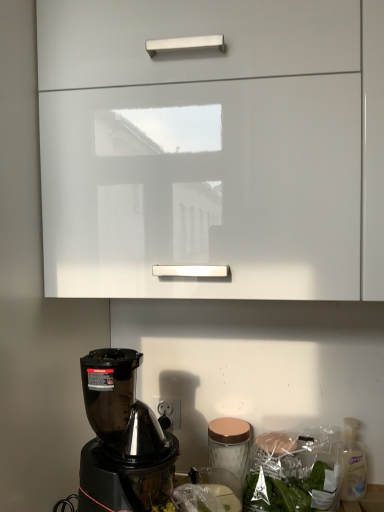
Where is `white glossy cabinet at upper center`? The image size is (384, 512). white glossy cabinet at upper center is located at coordinates (212, 148).

Describe the element at coordinates (212, 148) in the screenshot. I see `white glossy cabinet at upper center` at that location.

Where is `clear plastic bottle at lower right`? clear plastic bottle at lower right is located at coordinates (353, 463).

Image resolution: width=384 pixels, height=512 pixels. Describe the element at coordinates (353, 463) in the screenshot. I see `clear plastic bottle at lower right` at that location.

Where is `white glossy cabinet at upper center`? The height and width of the screenshot is (512, 384). white glossy cabinet at upper center is located at coordinates (212, 148).

Can you confirm if white glossy cabinet at upper center is positioned to the right of clear plastic bottle at lower right?

No.

Consider the image. Is white glossy cabinet at upper center in front of clear plastic bottle at lower right?

Yes.

Does point (275, 269) come farther from viewer compared to point (357, 484)?

No, it is not.

Based on the photo, from the image's perspective, is white glossy cabinet at upper center below clear plastic bottle at lower right?

No.

From a real-world perspective, which is physically below, white glossy cabinet at upper center or clear plastic bottle at lower right?

clear plastic bottle at lower right, from a real-world perspective.

Which object is wider, white glossy cabinet at upper center or clear plastic bottle at lower right?

Wider between the two is white glossy cabinet at upper center.

Which of these two, white glossy cabinet at upper center or clear plastic bottle at lower right, stands taller?

white glossy cabinet at upper center.

Considering the relative sizes of white glossy cabinet at upper center and clear plastic bottle at lower right in the image provided, is white glossy cabinet at upper center bigger than clear plastic bottle at lower right?

Yes.

Is white glossy cabinet at upper center outside of clear plastic bottle at lower right?

Yes, white glossy cabinet at upper center is located beyond the bounds of clear plastic bottle at lower right.

Is white glossy cabinet at upper center next to clear plastic bottle at lower right and touching it?

There is a gap between white glossy cabinet at upper center and clear plastic bottle at lower right.

Is white glossy cabinet at upper center oriented away from clear plastic bottle at lower right?

white glossy cabinet at upper center does not have its back to clear plastic bottle at lower right.

How different are the orientations of white glossy cabinet at upper center and clear plastic bottle at lower right in degrees?

They differ by 0.393 degrees in their facing directions.

This screenshot has height=512, width=384. In order to click on bottle below the white glossy cabinet at upper center (from the image's perspective) in this screenshot , I will do `click(353, 463)`.

In the scene shown: Is clear plastic bottle at lower right to the right of white glossy cabinet at upper center from the viewer's perspective?

Yes.

Does clear plastic bottle at lower right lie behind white glossy cabinet at upper center?

Yes, clear plastic bottle at lower right is further from the camera.

Does point (353, 454) come closer to viewer compared to point (362, 25)?

No.

From the image's perspective, is clear plastic bottle at lower right located above or below white glossy cabinet at upper center?

Clearly, from the image's perspective, clear plastic bottle at lower right is below white glossy cabinet at upper center.

Looking at this image, from a real-world perspective, is clear plastic bottle at lower right physically located above or below white glossy cabinet at upper center?

clear plastic bottle at lower right is situated lower than white glossy cabinet at upper center in the real world.

Which of these two, clear plastic bottle at lower right or white glossy cabinet at upper center, is wider?

white glossy cabinet at upper center is wider.

Is clear plastic bottle at lower right taller or shorter than white glossy cabinet at upper center?

Considering their sizes, clear plastic bottle at lower right has less height than white glossy cabinet at upper center.

In terms of size, does clear plastic bottle at lower right appear bigger or smaller than white glossy cabinet at upper center?

Considering their sizes, clear plastic bottle at lower right takes up less space than white glossy cabinet at upper center.

Is clear plastic bottle at lower right spatially inside white glossy cabinet at upper center, or outside of it?

clear plastic bottle at lower right exists outside the volume of white glossy cabinet at upper center.

Does clear plastic bottle at lower right touch white glossy cabinet at upper center?

There is a gap between clear plastic bottle at lower right and white glossy cabinet at upper center.

Is clear plastic bottle at lower right looking in the opposite direction of white glossy cabinet at upper center?

No, clear plastic bottle at lower right is not facing the opposite direction of white glossy cabinet at upper center.

From the picture: How different are the orientations of clear plastic bottle at lower right and white glossy cabinet at upper center in degrees?

0.393 degrees.

I want to click on bottle below the white glossy cabinet at upper center (from a real-world perspective), so click(353, 463).

At what (x,y) coordinates should I click in order to perform the action: click on bottle behind the white glossy cabinet at upper center. Please return your answer as a coordinate pair (x, y). The image size is (384, 512). Looking at the image, I should click on click(x=353, y=463).

I want to click on cabinetry located above the clear plastic bottle at lower right (from the image's perspective), so click(212, 148).